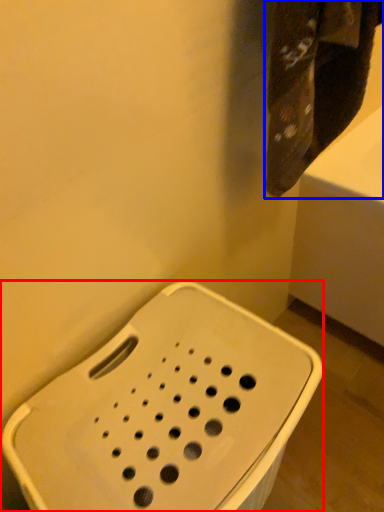
Question: Among these objects, which one is farthest to the camera, porcelain (highlighted by a red box) or towel (highlighted by a blue box)?

Choices:
 (A) porcelain
 (B) towel

Answer: (B)